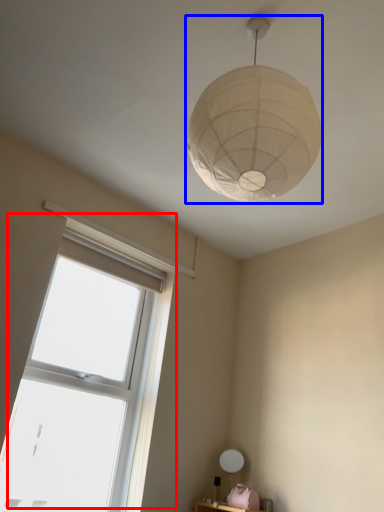
Question: Among these objects, which one is farthest to the camera, window (highlighted by a red box) or lamp (highlighted by a blue box)?

Choices:
 (A) window
 (B) lamp

Answer: (A)